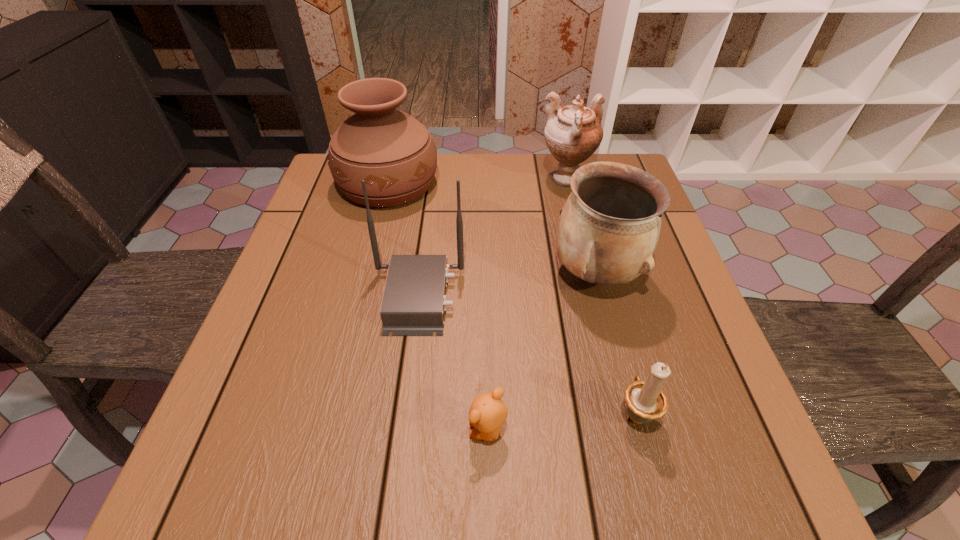
Where is `free spot that satisfies the following two spatial constraints: 1. on the handle side of the candle_holder; 2. on the back of the router to connect cables`? free spot that satisfies the following two spatial constraints: 1. on the handle side of the candle_holder; 2. on the back of the router to connect cables is located at coordinates (606, 297).

At what (x,y) coordinates should I click in order to perform the action: click on vacant region that satisfies the following two spatial constraints: 1. on the back of the router to connect cables; 2. on the handle side of the second shortest object. Please return your answer as a coordinate pair (x, y). This screenshot has width=960, height=540. Looking at the image, I should click on (402, 413).